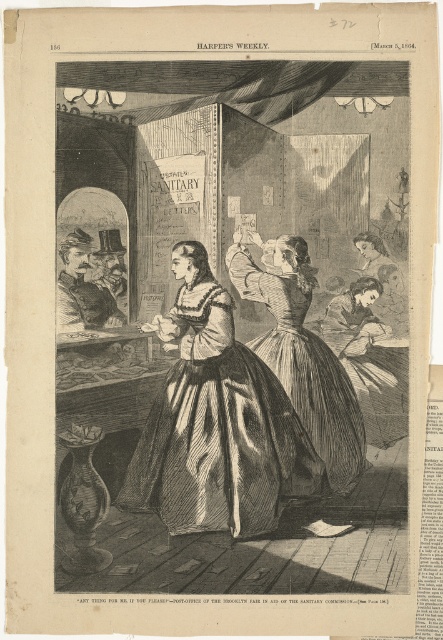
You are a customer in a 19th century store and see two dresses displayed at the center of the store. The dresses are both labeled as silvery satin dress at center and silvery metallic dress at center. Which dress is located to the left when viewed from the front?

The silvery satin dress at center is positioned on the left side of silvery metallic dress at center, so the silvery satin dress at center is the one located to the left.

You are a tailor in the 1860s who has two dresses in front of you, the silvery satin dress at center and the silvery metallic dress at center. Which dress requires more fabric to make?

The silvery metallic dress at center requires more fabric since it is larger than the silvery satin dress at center.